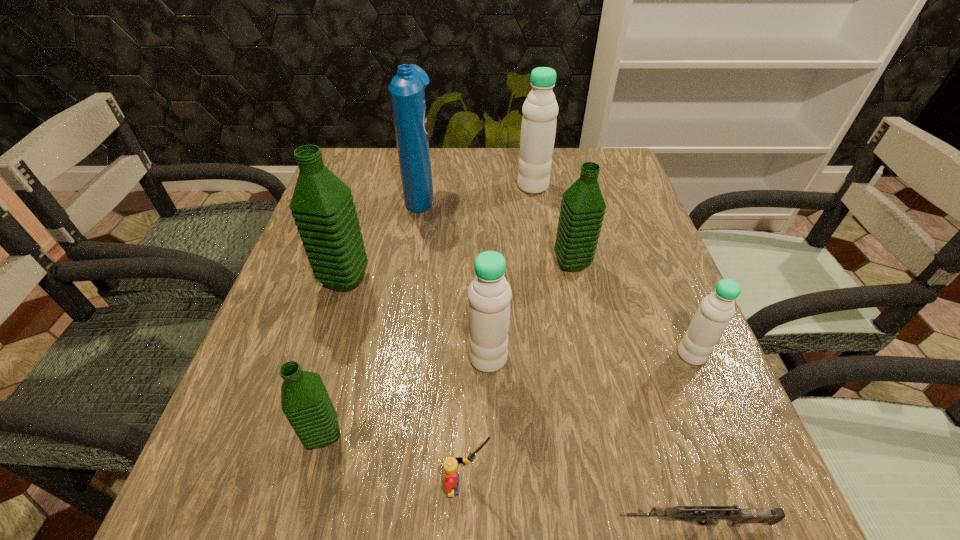
This screenshot has width=960, height=540. What are the coordinates of `vacant space that's between the rightmost white water bottle and the nearest green water bottle` in the screenshot? It's located at (508, 395).

This screenshot has height=540, width=960. I want to click on vacant area that lies between the second nearest object and the shampoo, so click(444, 339).

At what (x,y) coordinates should I click in order to perform the action: click on free space between the gun and the biggest green water bottle. Please return your answer as a coordinate pair (x, y). The height and width of the screenshot is (540, 960). Looking at the image, I should click on pos(520,402).

Find the location of a particular element. The image size is (960, 540). free spot between the second biggest green water bottle and the leftmost white water bottle is located at coordinates 530,310.

The image size is (960, 540). I want to click on vacant area that lies between the biggest green water bottle and the rightmost green water bottle, so click(459, 272).

Identify the location of blank region between the third object from left to right and the nearest green water bottle. (372, 313).

The height and width of the screenshot is (540, 960). I want to click on blank region between the gun and the biggest green water bottle, so click(x=520, y=402).

At what (x,y) coordinates should I click in order to perform the action: click on free space between the third nearest object and the yellow Lego. Please return your answer as a coordinate pair (x, y). The height and width of the screenshot is (540, 960). Looking at the image, I should click on (396, 460).

Locate an element on the screen. Image resolution: width=960 pixels, height=540 pixels. the sixth closest object relative to the third object from left to right is located at coordinates (716, 310).

The image size is (960, 540). What are the coordinates of `object that is the fourth closest to the Lego` in the screenshot? It's located at (716, 310).